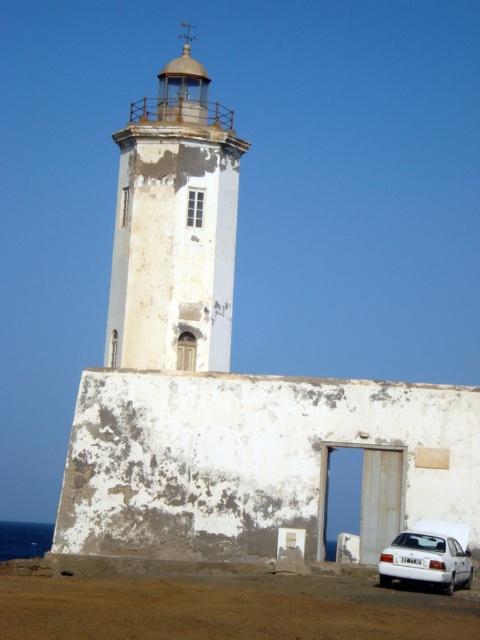
Does point (159, 300) come farther from viewer compared to point (392, 556)?

Yes.

Does white weathered tower at center appear under white matte car at lower right?

No, white weathered tower at center is not below white matte car at lower right.

Identify the location of white weathered tower at center. The width and height of the screenshot is (480, 640). (175, 227).